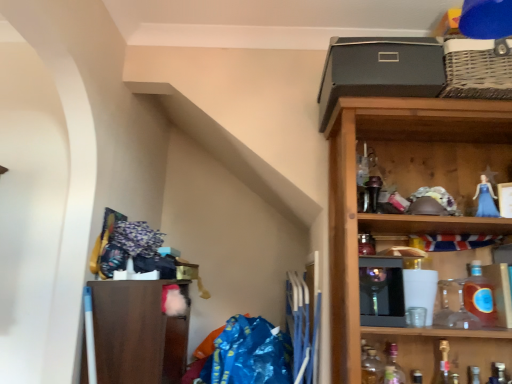
Question: Is wooden shelf at upper right, which is the 1th shelf from right to left, bigger than gold metallic bottle at lower right, the third bottle positioned from the right?

Choices:
 (A) no
 (B) yes

Answer: (B)

Question: Could you tell me if wooden shelf at upper right, which is the 1th shelf from right to left, is facing gold metallic bottle at lower right, the 3th bottle in the left-to-right sequence?

Choices:
 (A) no
 (B) yes

Answer: (A)

Question: From the image's perspective, would you say wooden shelf at upper right, which is the 1th shelf from right to left, is positioned over gold metallic bottle at lower right, the 3th bottle in the left-to-right sequence?

Choices:
 (A) no
 (B) yes

Answer: (B)

Question: From a real-world perspective, is wooden shelf at upper right, which is the 1th shelf from right to left, over gold metallic bottle at lower right, the third bottle positioned from the right?

Choices:
 (A) yes
 (B) no

Answer: (A)

Question: Can you confirm if wooden shelf at upper right, which is the 1th shelf from right to left, is positioned to the left of gold metallic bottle at lower right, the 3th bottle in the left-to-right sequence?

Choices:
 (A) yes
 (B) no

Answer: (A)

Question: Considering the relative positions of wooden shelf at upper right, which ranks as the second shelf in left-to-right order, and gold metallic bottle at lower right, the third bottle positioned from the right, in the image provided, is wooden shelf at upper right, which ranks as the second shelf in left-to-right order, behind gold metallic bottle at lower right, the third bottle positioned from the right,?

Choices:
 (A) yes
 (B) no

Answer: (B)

Question: From the image's perspective, is matte gray box at upper right beneath translucent glass bottle at lower right, the second bottle viewed from the left?

Choices:
 (A) yes
 (B) no

Answer: (B)

Question: Is matte gray box at upper right to the left of translucent glass bottle at lower right, arranged as the fourth bottle when viewed from the right, from the viewer's perspective?

Choices:
 (A) yes
 (B) no

Answer: (A)

Question: Is there a large distance between matte gray box at upper right and translucent glass bottle at lower right, the second bottle viewed from the left?

Choices:
 (A) no
 (B) yes

Answer: (A)

Question: From the image's perspective, is matte gray box at upper right over translucent glass bottle at lower right, arranged as the fourth bottle when viewed from the right?

Choices:
 (A) yes
 (B) no

Answer: (A)

Question: Can translucent glass bottle at lower right, arranged as the fourth bottle when viewed from the right, be found inside matte gray box at upper right?

Choices:
 (A) yes
 (B) no

Answer: (B)

Question: Is matte gray box at upper right bigger than translucent glass bottle at lower right, the second bottle viewed from the left?

Choices:
 (A) no
 (B) yes

Answer: (B)

Question: Can you confirm if translucent amber glass bottle at right, the 4th bottle from the left, is positioned to the left of translucent glass bottle at lower right, which appears as the 1th bottle when viewed from the left?

Choices:
 (A) yes
 (B) no

Answer: (B)